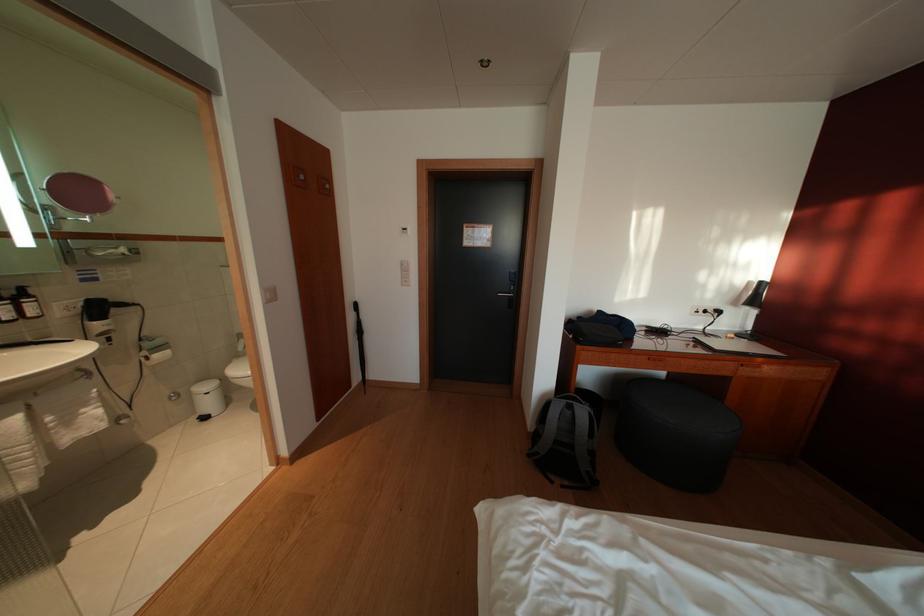
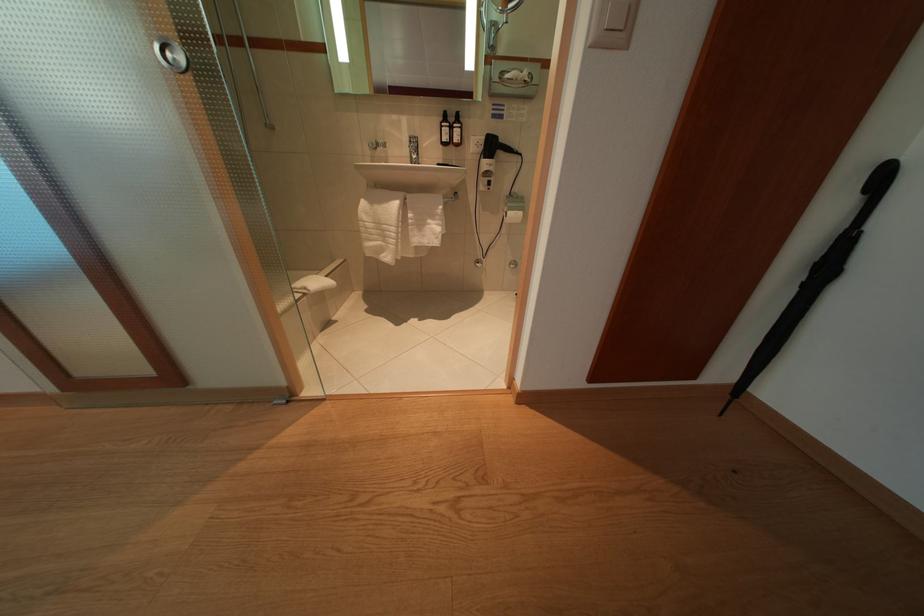
Locate, in the second image, the point that corresponds to pixel 368 338 in the first image.

(834, 275)